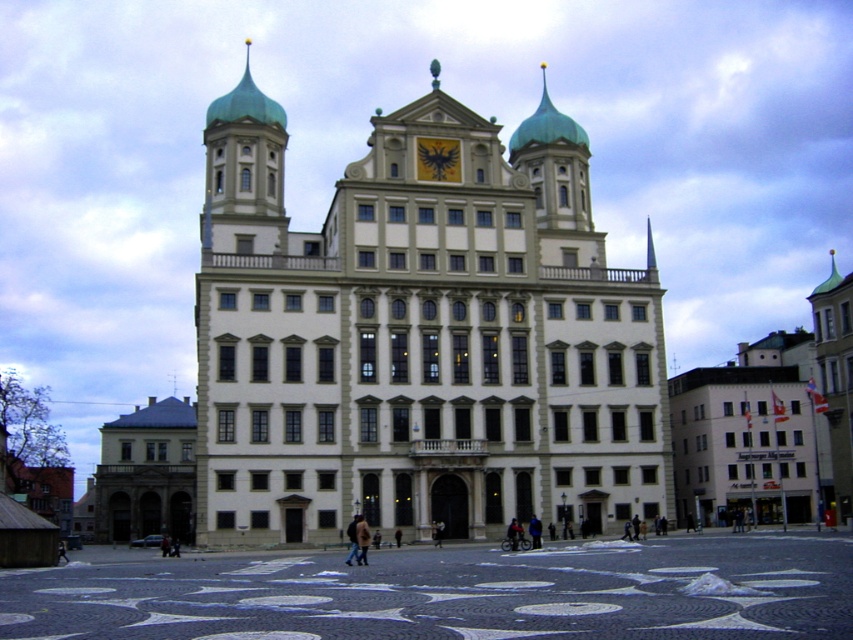
Between point (302, 496) and point (436, 148), which one is positioned behind?

The point (436, 148) is behind.

Can you confirm if white stone building at center is positioned to the left of gold metallic clock at center?

In fact, white stone building at center is to the right of gold metallic clock at center.

Does point (548, 300) lie behind point (450, 157)?

That is False.

At what (x,y) coordinates should I click in order to perform the action: click on white stone building at center. Please return your answer as a coordinate pair (x, y). The image size is (853, 640). Looking at the image, I should click on coord(419,337).